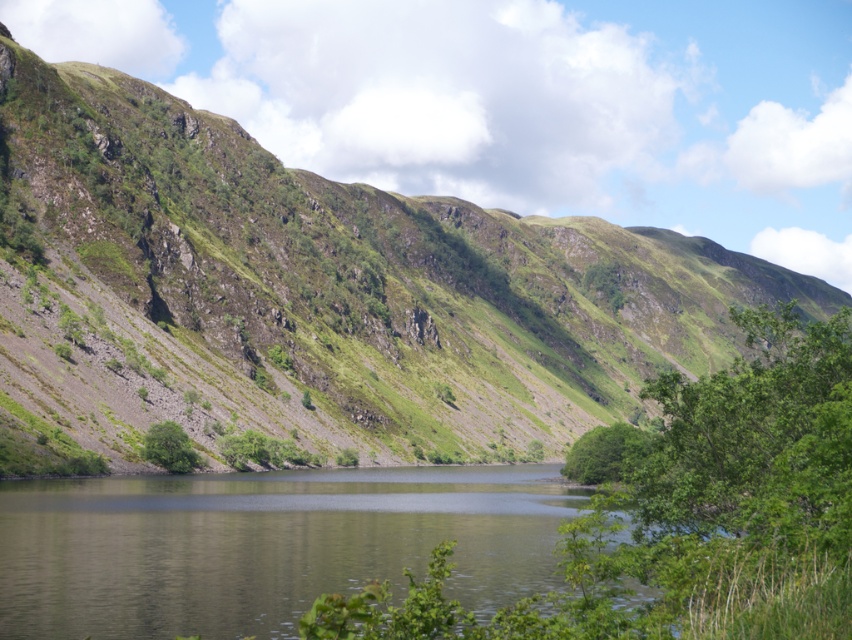
Question: Which point is closer to the camera taking this photo?

Choices:
 (A) (186, 461)
 (B) (220, 308)
 (C) (50, 524)
 (D) (608, 451)

Answer: (C)

Question: Estimate the real-world distances between objects in this image. Which object is closer to the green leafy tree at lower left?

Choices:
 (A) greenish water at center
 (B) green grassy hillside at center

Answer: (A)

Question: Does green grassy hillside at center appear on the left side of green leafy tree at lower left?

Choices:
 (A) no
 (B) yes

Answer: (A)

Question: Which point is closer to the camera?

Choices:
 (A) green grassy hillside at center
 (B) green leafy tree at lower left

Answer: (A)

Question: Is green grassy hillside at center smaller than green leafy tree at center?

Choices:
 (A) yes
 (B) no

Answer: (B)

Question: Is green leafy tree at center to the right of green leafy tree at lower left from the viewer's perspective?

Choices:
 (A) no
 (B) yes

Answer: (B)